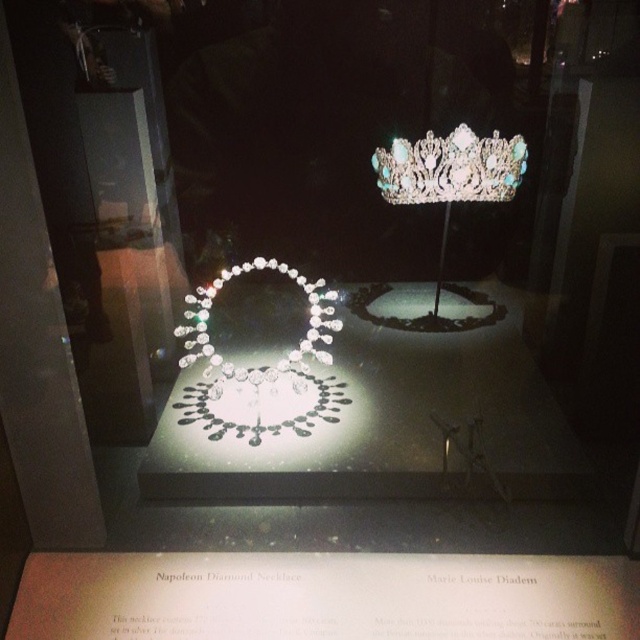
Question: Does clear crystal crown at upper center appear over clear crystal necklace at center?

Choices:
 (A) no
 (B) yes

Answer: (B)

Question: Can you confirm if clear crystal crown at upper center is bigger than clear crystal necklace at center?

Choices:
 (A) no
 (B) yes

Answer: (A)

Question: Which point is farther to the camera?

Choices:
 (A) (484, 140)
 (B) (244, 380)

Answer: (A)

Question: From the image, what is the correct spatial relationship of clear crystal crown at upper center in relation to clear crystal necklace at center?

Choices:
 (A) left
 (B) right

Answer: (B)

Question: Which point is farther to the camera?

Choices:
 (A) clear crystal crown at upper center
 (B) clear crystal necklace at center

Answer: (A)